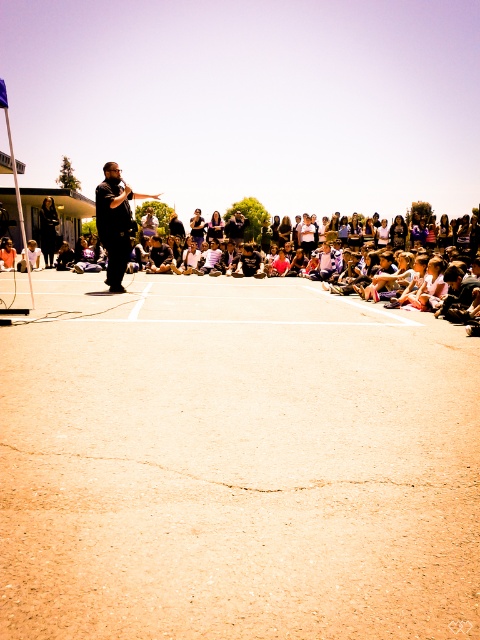
Question: Is multicolored fabric crowd at center in front of black fabric at center?

Choices:
 (A) yes
 (B) no

Answer: (A)

Question: Which is farther from the black matte shirt at center?

Choices:
 (A) multicolored fabric crowd at center
 (B) white cotton shirt at center
 (C) black fabric at center

Answer: (B)

Question: Considering the relative positions of multicolored fabric crowd at center and black matte shirt at center in the image provided, where is multicolored fabric crowd at center located with respect to black matte shirt at center?

Choices:
 (A) left
 (B) right

Answer: (B)

Question: Which point is farther from the camera taking this photo?

Choices:
 (A) (119, 237)
 (B) (48, 256)

Answer: (B)

Question: Which object is closer to the camera taking this photo?

Choices:
 (A) black fabric at center
 (B) multicolored fabric crowd at center
 (C) black matte shirt at center

Answer: (B)

Question: Does black matte shirt at center have a greater width compared to black fabric at center?

Choices:
 (A) no
 (B) yes

Answer: (B)